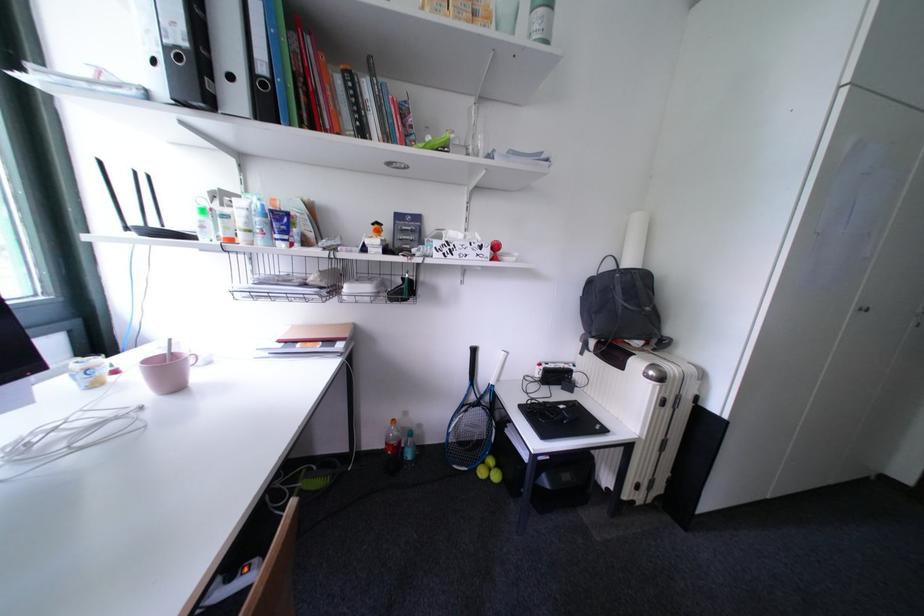
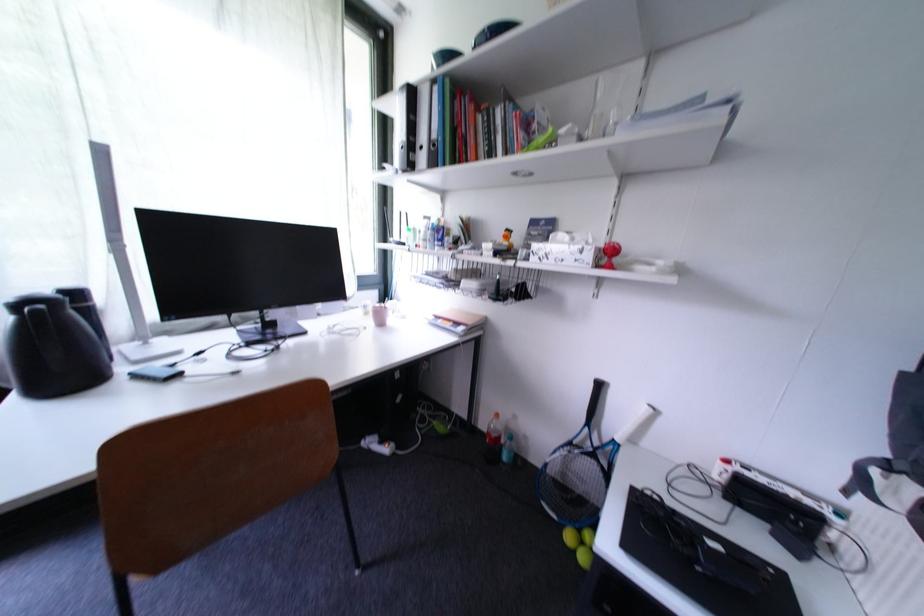
Question: The camera is either moving clockwise (left) or counter-clockwise (right) around the object. The first image is from the beginning of the video and the second image is from the end. Is the camera moving left or right when shooting the video?

Choices:
 (A) Left
 (B) Right

Answer: (B)